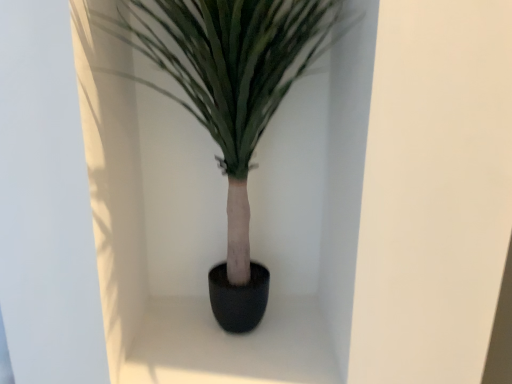
Question: Should I look upward or downward to see green matte plant at center?

Choices:
 (A) down
 (B) up

Answer: (B)

Question: Is black matte pot at center shorter than green matte plant at center?

Choices:
 (A) yes
 (B) no

Answer: (A)

Question: Is black matte pot at center wider than green matte plant at center?

Choices:
 (A) yes
 (B) no

Answer: (A)

Question: Does black matte pot at center have a lesser width compared to green matte plant at center?

Choices:
 (A) yes
 (B) no

Answer: (B)

Question: Can green matte plant at center be found inside black matte pot at center?

Choices:
 (A) no
 (B) yes

Answer: (A)

Question: Is black matte pot at center next to green matte plant at center and touching it?

Choices:
 (A) yes
 (B) no

Answer: (B)

Question: From the image's perspective, is black matte pot at center on green matte plant at center?

Choices:
 (A) yes
 (B) no

Answer: (B)

Question: Could you tell me if green matte plant at center is facing black matte pot at center?

Choices:
 (A) no
 (B) yes

Answer: (A)

Question: Does green matte plant at center have a lesser width compared to black matte pot at center?

Choices:
 (A) yes
 (B) no

Answer: (A)

Question: From a real-world perspective, is green matte plant at center under black matte pot at center?

Choices:
 (A) no
 (B) yes

Answer: (A)

Question: Considering the relative positions of green matte plant at center and black matte pot at center in the image provided, is green matte plant at center to the right of black matte pot at center from the viewer's perspective?

Choices:
 (A) no
 (B) yes

Answer: (A)

Question: Is green matte plant at center positioned behind black matte pot at center?

Choices:
 (A) yes
 (B) no

Answer: (B)

Question: From the image's perspective, is green matte plant at center under black matte pot at center?

Choices:
 (A) yes
 (B) no

Answer: (B)

Question: Is black matte pot at center taller or shorter than green matte plant at center?

Choices:
 (A) tall
 (B) short

Answer: (B)